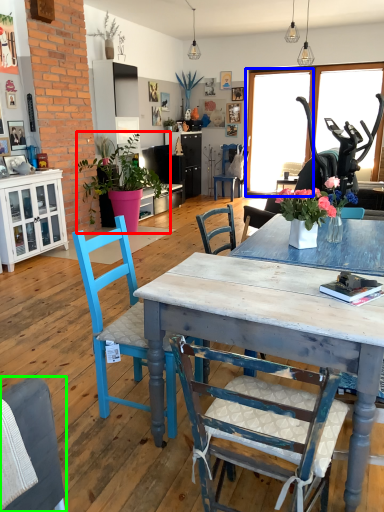
Question: Which is nearer to the houseplant (highlighted by a red box)? window screen (highlighted by a blue box) or chair (highlighted by a green box).

Choices:
 (A) window screen
 (B) chair

Answer: (A)